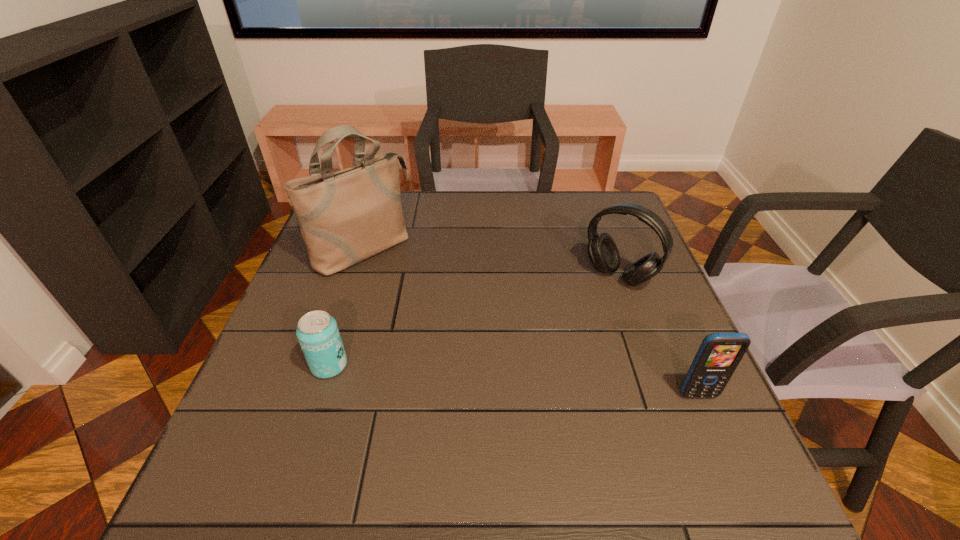
The width and height of the screenshot is (960, 540). Identify the location of the shortest object. (317, 332).

In order to click on the third farthest object in this screenshot , I will do `click(317, 332)`.

You are a GUI agent. You are given a task and a screenshot of the screen. Output one action in this format:
    pyautogui.click(x=<x>, y=<y>)
    Task: Click on the cellular telephone
    
    Given the screenshot: What is the action you would take?
    pyautogui.click(x=719, y=354)

I want to click on shoulder bag, so click(x=347, y=216).

Find the location of a particular element. headset is located at coordinates (603, 253).

Where is `vacant space located on the back of the shortest object`? Image resolution: width=960 pixels, height=540 pixels. vacant space located on the back of the shortest object is located at coordinates (354, 286).

At what (x,y) coordinates should I click in order to perform the action: click on vacant space located 0.110m on the front-facing side of the tallest object. Please return your answer as a coordinate pair (x, y). Looking at the image, I should click on (416, 291).

Image resolution: width=960 pixels, height=540 pixels. I want to click on vacant space located on the front-facing side of the tallest object, so click(413, 289).

I want to click on free space located on the front-facing side of the tallest object, so click(x=472, y=338).

Locate an element on the screen. This screenshot has height=540, width=960. vacant space located 0.260m on the earcups of the headset is located at coordinates (548, 357).